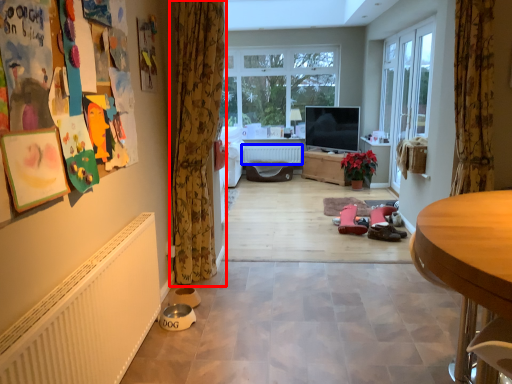
Question: Which object appears closest to the camera in this image, curtain (highlighted by a red box) or radiator (highlighted by a blue box)?

Choices:
 (A) curtain
 (B) radiator

Answer: (A)